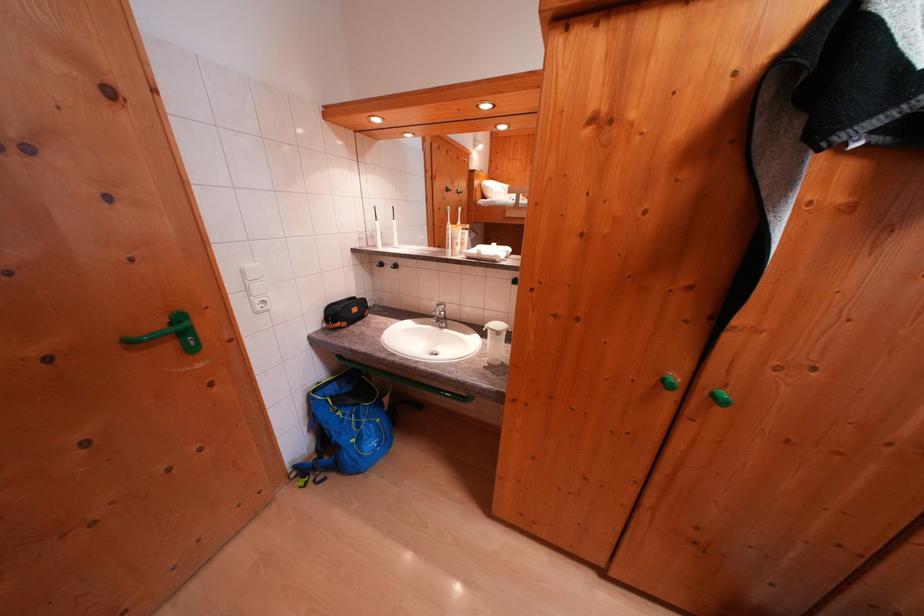
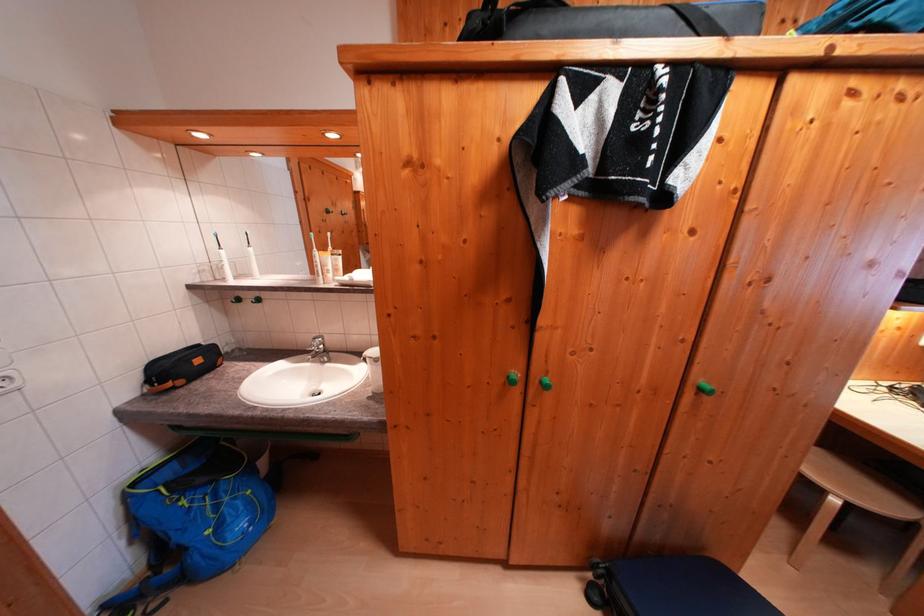
The point at (322,395) is marked in the first image. Where is the corresponding point in the second image?

(142, 488)